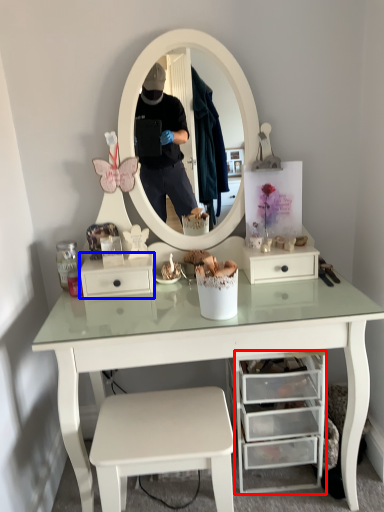
Question: Which point is further to the camera, drawer (highlighted by a red box) or drawer (highlighted by a blue box)?

Choices:
 (A) drawer
 (B) drawer

Answer: (B)